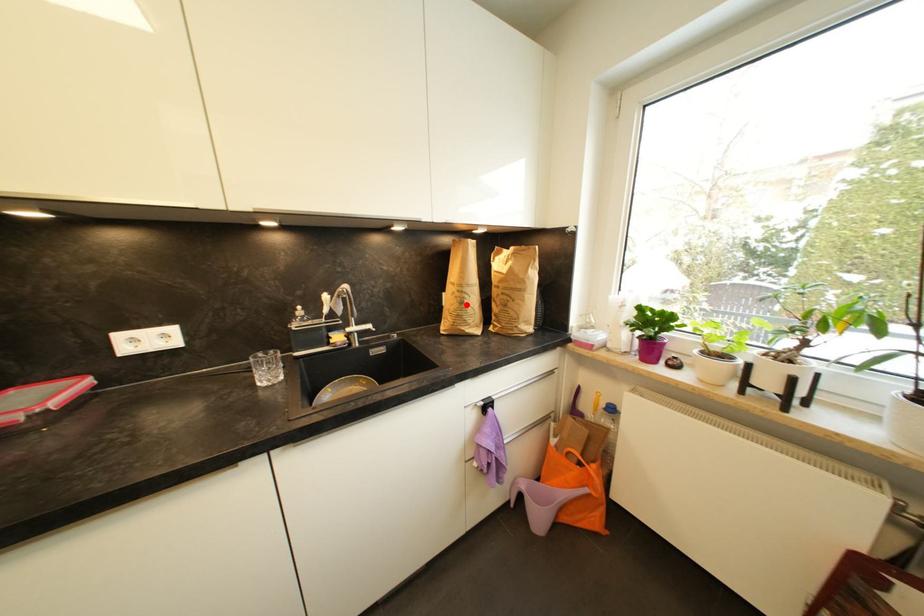
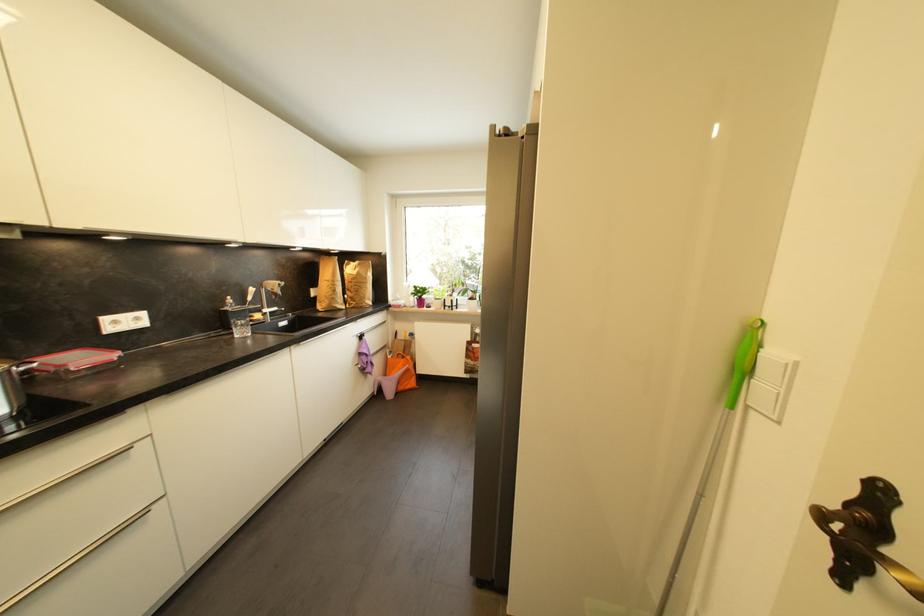
Question: A red point is marked in image1. In image2, is the corresponding 3D point closer to the camera or farther? Reply with the corresponding letter.

Choices:
 (A) The corresponding 3D point is closer.
 (B) The corresponding 3D point is farther.

Answer: (A)